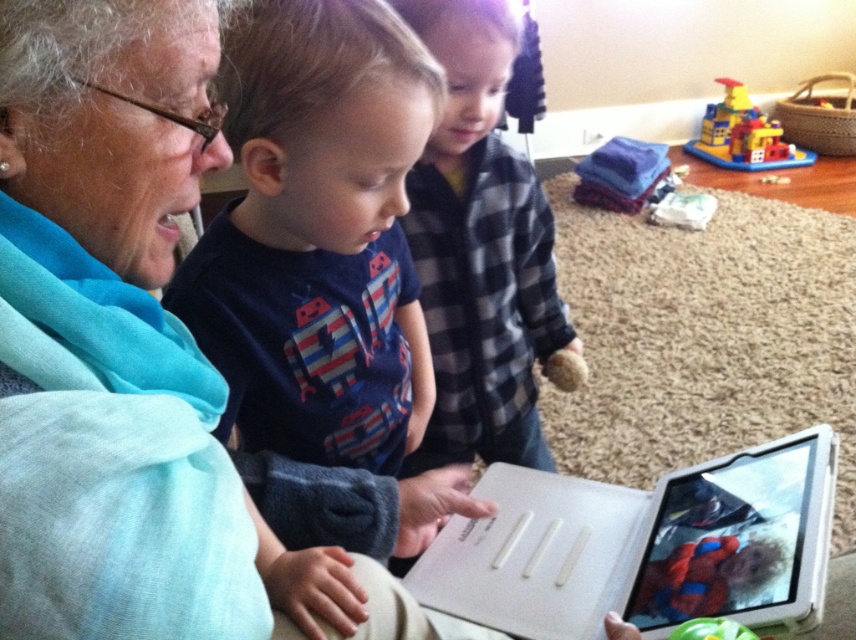
Which is in front, point (214, 592) or point (723, 118)?

Point (214, 592)

Identify the location of matte blue scarf at upper left. This screenshot has width=856, height=640. (111, 337).

Between matte blue shirt at center and green fabric toy at lower right, which one appears on the right side from the viewer's perspective?

green fabric toy at lower right is more to the right.

Who is more forward, (248, 184) or (715, 621)?

Point (715, 621) is in front.

Identify the location of matte blue shirt at center. This screenshot has width=856, height=640. (317, 236).

Is white plastic tablet at center taller than brick-like plastic toy at upper right?

In fact, white plastic tablet at center may be shorter than brick-like plastic toy at upper right.

Is white plastic tablet at center positioned in front of brick-like plastic toy at upper right?

Yes, it is in front of brick-like plastic toy at upper right.

You are a GUI agent. You are given a task and a screenshot of the screen. Output one action in this format:
    pyautogui.click(x=<x>, y=<y>)
    Task: Click on the white plastic tablet at center
    The image size is (856, 640).
    Given the screenshot: What is the action you would take?
    pyautogui.click(x=740, y=538)

Locate an element on the screen. white plastic tablet at center is located at coordinates (740, 538).